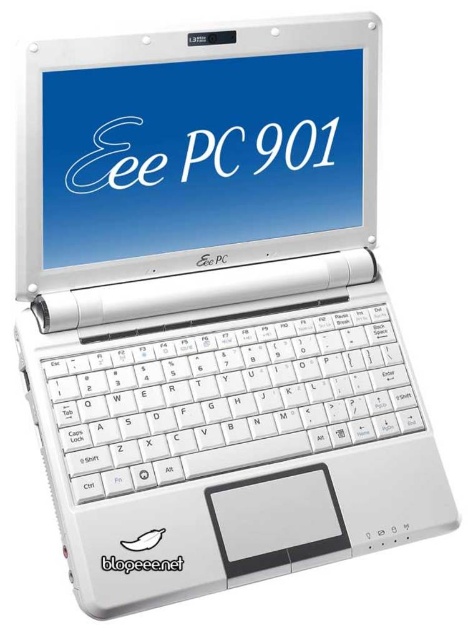
Question: Which object is farther from the camera taking this photo?

Choices:
 (A) white plastic keyboard at center
 (B) matte white screen at center

Answer: (B)

Question: Can you confirm if matte white screen at center is positioned below white plastic keyboard at center?

Choices:
 (A) no
 (B) yes

Answer: (A)

Question: Can you confirm if matte white screen at center is bigger than white plastic keyboard at center?

Choices:
 (A) yes
 (B) no

Answer: (A)

Question: Does matte white screen at center have a larger size compared to white plastic keyboard at center?

Choices:
 (A) yes
 (B) no

Answer: (A)

Question: Which object appears farthest from the camera in this image?

Choices:
 (A) matte white screen at center
 (B) white plastic keyboard at center

Answer: (A)